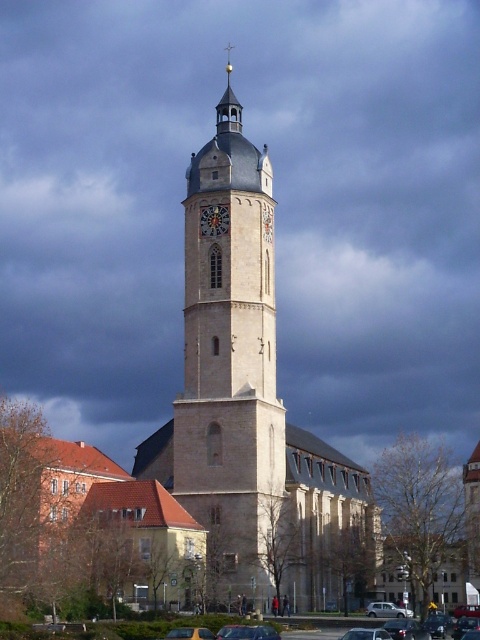
Question: Which point appears closest to the camera in this image?

Choices:
 (A) (218, 225)
 (B) (479, 612)
 (C) (384, 602)

Answer: (A)

Question: Can you confirm if beige stone tower at center is positioned to the right of yellow matte car at center?

Choices:
 (A) no
 (B) yes

Answer: (B)

Question: Does metallic silver car at center come behind yellow matte car at center?

Choices:
 (A) no
 (B) yes

Answer: (B)

Question: Which point is farther from the camera taking this photo?

Choices:
 (A) (192, 632)
 (B) (263, 493)
 (C) (204, 225)

Answer: (C)

Question: Which point is farther to the camera?

Choices:
 (A) yellow matte car at center
 (B) metallic red car at center

Answer: (B)

Question: Does matte gray clock at center have a larger size compared to metallic silver sedan at center?

Choices:
 (A) no
 (B) yes

Answer: (A)